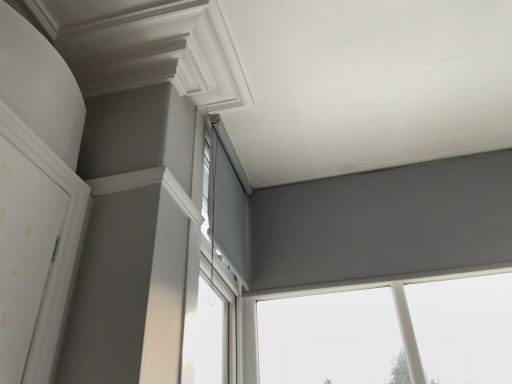
Question: Does matte gray roller blind at center, the second window from the left, appear on the right side of white plastic window at upper center, the third window when ordered from right to left?

Choices:
 (A) no
 (B) yes

Answer: (B)

Question: Is matte gray roller blind at center, the second window from the left, bigger than white plastic window at upper center, the third window when ordered from right to left?

Choices:
 (A) no
 (B) yes

Answer: (A)

Question: Can we say matte gray roller blind at center, acting as the 2th window starting from the right, lies outside white plastic window at upper center, acting as the first window starting from the left?

Choices:
 (A) yes
 (B) no

Answer: (A)

Question: From a real-world perspective, is matte gray roller blind at center, the second window from the left, positioned over white plastic window at upper center, the third window when ordered from right to left, based on gravity?

Choices:
 (A) no
 (B) yes

Answer: (B)

Question: Are matte gray roller blind at center, acting as the 2th window starting from the right, and white plastic window at upper center, the third window when ordered from right to left, located far from each other?

Choices:
 (A) no
 (B) yes

Answer: (A)

Question: From the image's perspective, is matte gray window at upper center, placed as the first window when sorted from right to left, above or below white plastic window at upper center, the third window when ordered from right to left?

Choices:
 (A) above
 (B) below

Answer: (B)

Question: In the image, is matte gray window at upper center, placed as the first window when sorted from right to left, positioned in front of or behind white plastic window at upper center, the third window when ordered from right to left?

Choices:
 (A) front
 (B) behind

Answer: (B)

Question: Is matte gray window at upper center, placed as the first window when sorted from right to left, to the left or to the right of white plastic window at upper center, acting as the first window starting from the left, in the image?

Choices:
 (A) left
 (B) right

Answer: (B)

Question: From a real-world perspective, is matte gray window at upper center, the third window positioned from the left, physically located above or below white plastic window at upper center, acting as the first window starting from the left?

Choices:
 (A) above
 (B) below

Answer: (A)

Question: Is matte gray roller blind at center, acting as the 2th window starting from the right, bigger or smaller than matte gray window at upper center, the third window positioned from the left?

Choices:
 (A) small
 (B) big

Answer: (A)

Question: Considering the positions of matte gray roller blind at center, acting as the 2th window starting from the right, and matte gray window at upper center, the third window positioned from the left, in the image, is matte gray roller blind at center, acting as the 2th window starting from the right, taller or shorter than matte gray window at upper center, the third window positioned from the left,?

Choices:
 (A) short
 (B) tall

Answer: (A)

Question: From a real-world perspective, relative to matte gray window at upper center, placed as the first window when sorted from right to left, is matte gray roller blind at center, acting as the 2th window starting from the right, vertically above or below?

Choices:
 (A) above
 (B) below

Answer: (A)

Question: Is point (214, 163) closer or farther from the camera than point (426, 284)?

Choices:
 (A) farther
 (B) closer

Answer: (B)

Question: Considering their positions, is white plastic window at upper center, acting as the first window starting from the left, located in front of or behind matte gray roller blind at center, the second window from the left?

Choices:
 (A) front
 (B) behind

Answer: (A)

Question: Considering the positions of point (197, 145) and point (222, 236), is point (197, 145) closer or farther from the camera than point (222, 236)?

Choices:
 (A) closer
 (B) farther

Answer: (A)